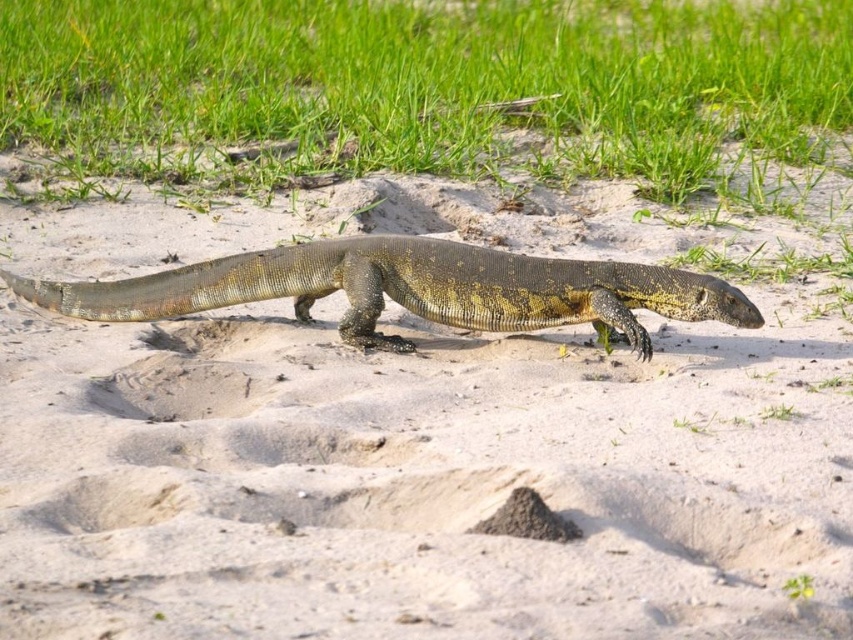
Consider the image. Who is taller, green grass at upper center or brown scaly lizard at center?

brown scaly lizard at center

Who is shorter, green grass at upper center or brown scaly lizard at center?

green grass at upper center

Which is behind, point (837, 28) or point (210, 304)?

Positioned behind is point (837, 28).

Image resolution: width=853 pixels, height=640 pixels. Find the location of `green grass at upper center`. green grass at upper center is located at coordinates tap(428, 81).